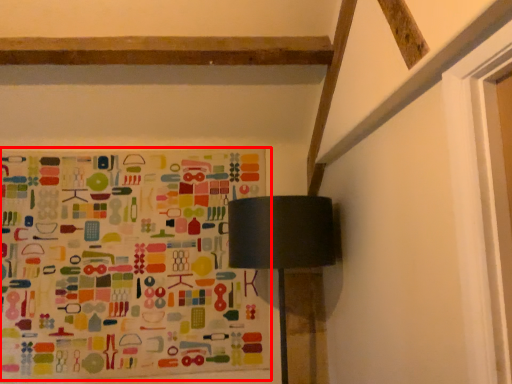
Question: Where is bulletin board (annotated by the red box) located in relation to table lamp in the image?

Choices:
 (A) right
 (B) left

Answer: (B)